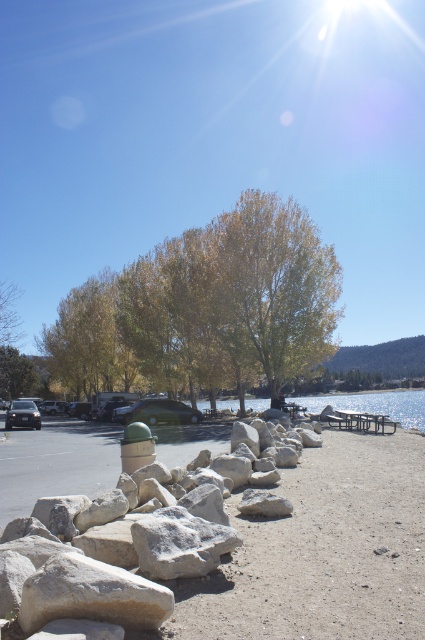
Question: Is golden textured tree at center below metallic silver picnic table at center?

Choices:
 (A) no
 (B) yes

Answer: (A)

Question: Which object is positioned farthest from the metallic silver picnic table at center?

Choices:
 (A) clear blue water at center
 (B) golden textured tree at center

Answer: (B)

Question: Based on their relative distances, which object is farther from the green matte hydrant at center?

Choices:
 (A) gray rough stone at lower left
 (B) golden textured tree at center
 (C) metallic silver picnic table at center
 (D) clear blue water at center

Answer: (D)

Question: Is gray rough stone at lower left further to the viewer compared to clear blue water at center?

Choices:
 (A) yes
 (B) no

Answer: (B)

Question: Which point is closer to the camera taking this photo?

Choices:
 (A) (396, 397)
 (B) (371, 426)
 (C) (130, 499)
 (D) (263, 326)

Answer: (C)

Question: Where is gray rough stone at lower left located in relation to clear blue water at center in the image?

Choices:
 (A) right
 (B) left

Answer: (B)